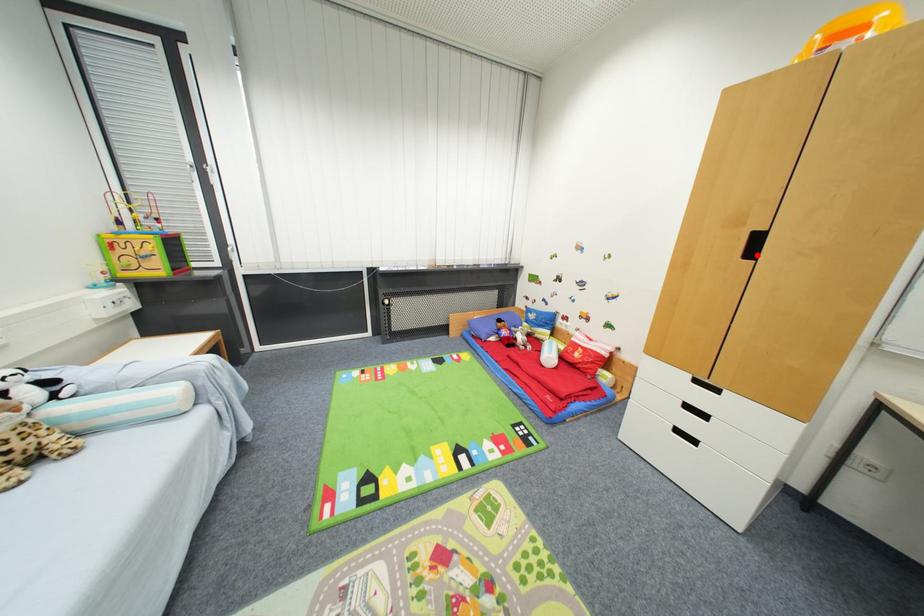
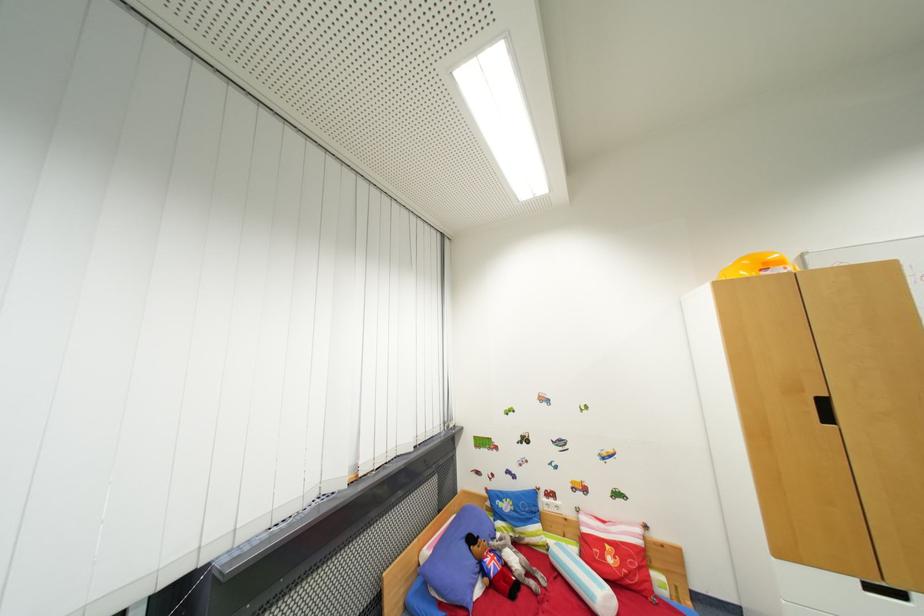
Question: I am providing you with two images of the same scene from different viewpoints. A red point is shown in image1. For the corresponding object point in image2, is it positioned nearer or farther from the camera?

Choices:
 (A) Nearer
 (B) Farther

Answer: (A)